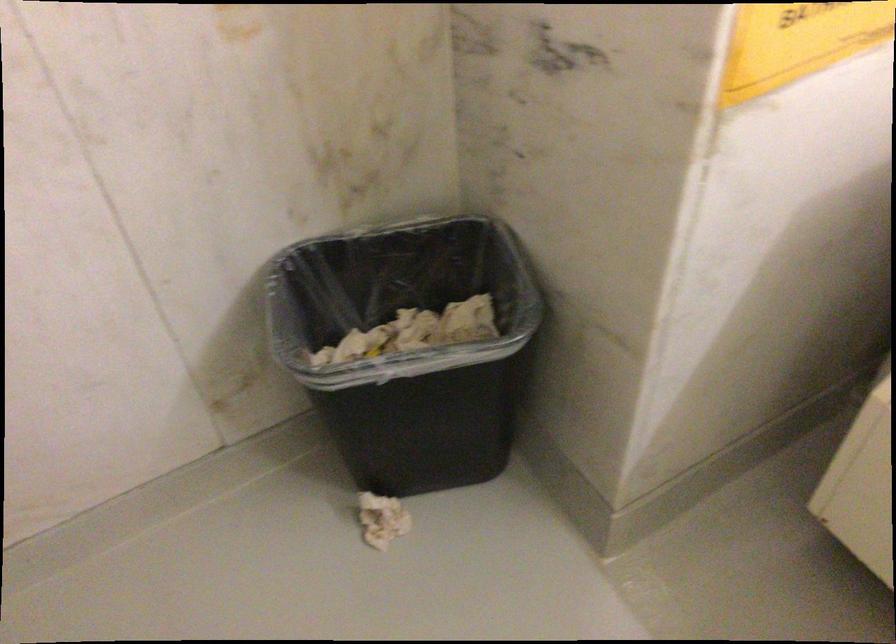
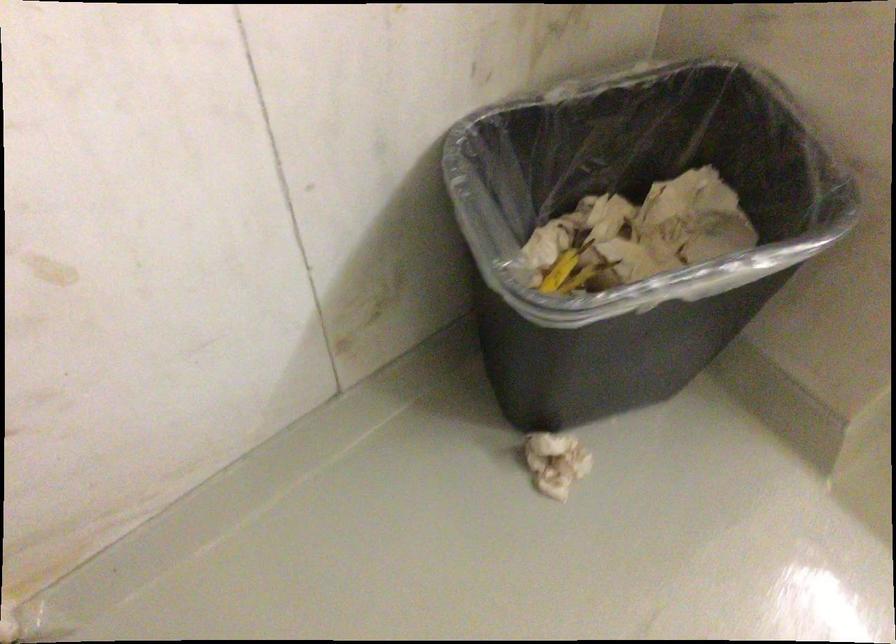
What movement of the cameraman would produce the second image?

The movement direction of the cameraman is left, forward.